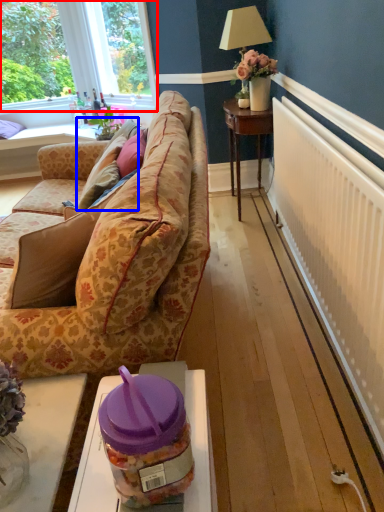
Question: Which object appears farthest to the camera in this image, window (highlighted by a red box) or pillow (highlighted by a blue box)?

Choices:
 (A) window
 (B) pillow

Answer: (A)